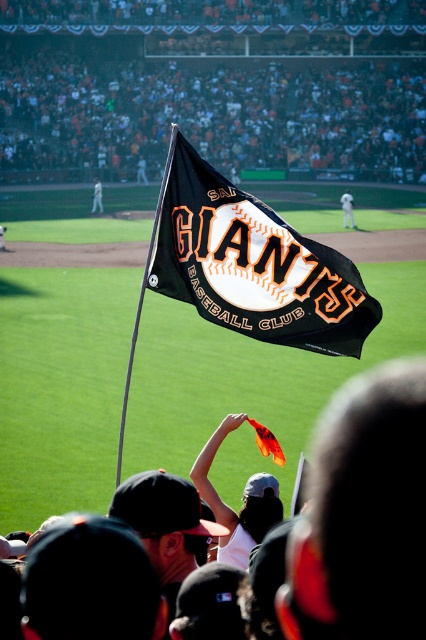
Between black fabric crowd at upper center and white uniform at center, which one has less height?

Standing shorter between the two is white uniform at center.

Does black fabric crowd at upper center come in front of white uniform at center?

No, black fabric crowd at upper center is further to the viewer.

You are a GUI agent. You are given a task and a screenshot of the screen. Output one action in this format:
    pyautogui.click(x=<x>, y=<y>)
    Task: Click on the black fabric crowd at upper center
    The image size is (426, 640).
    Given the screenshot: What is the action you would take?
    pyautogui.click(x=213, y=84)

Where is `black fabric crowd at upper center`? The height and width of the screenshot is (640, 426). black fabric crowd at upper center is located at coordinates (213, 84).

The height and width of the screenshot is (640, 426). What do you see at coordinates (213, 84) in the screenshot?
I see `black fabric crowd at upper center` at bounding box center [213, 84].

Which of these two, black fabric crowd at upper center or black fabric flag at center, stands taller?

black fabric crowd at upper center is taller.

Where is `black fabric crowd at upper center`? black fabric crowd at upper center is located at coordinates (213, 84).

Locate an element on the screen. The height and width of the screenshot is (640, 426). black fabric crowd at upper center is located at coordinates (213, 84).

Which is below, black fabric crowd at upper center or white fabric flag at upper center?

Positioned lower is white fabric flag at upper center.

Does black fabric crowd at upper center have a lesser width compared to white fabric flag at upper center?

No, black fabric crowd at upper center is not thinner than white fabric flag at upper center.

Which is in front, point (94, 88) or point (95, 198)?

Positioned in front is point (95, 198).

Find the location of a particular element. The image size is (426, 640). black fabric crowd at upper center is located at coordinates (213, 84).